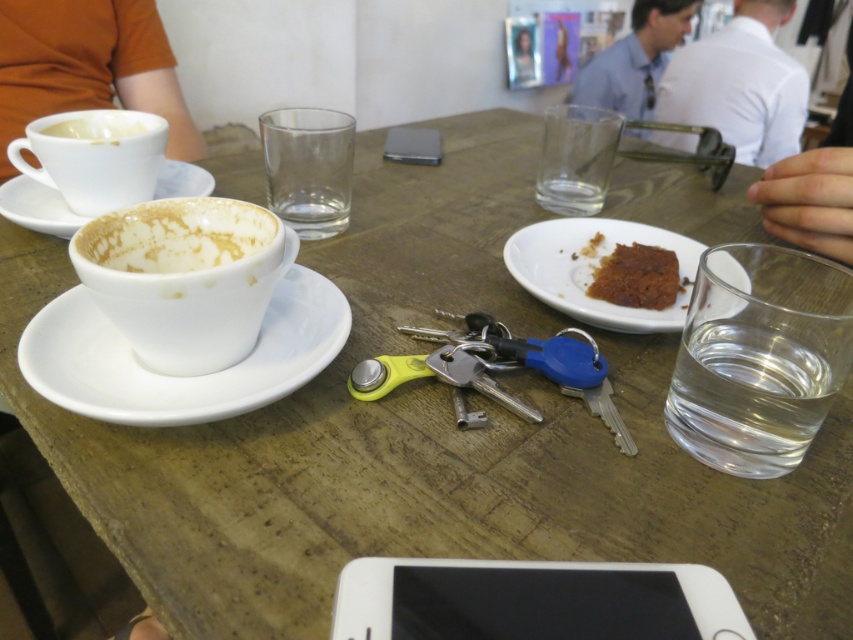
Question: Is matte orange shirt at upper left in front of white shirt at upper right?

Choices:
 (A) yes
 (B) no

Answer: (A)

Question: Estimate the real-world distances between objects in this image. Which object is farther from the white ceramic cup at upper left?

Choices:
 (A) white matte cup at upper left
 (B) white ceramic saucer at left

Answer: (B)

Question: Can you confirm if white ceramic saucer at lower left is positioned below blue shirt at upper center?

Choices:
 (A) yes
 (B) no

Answer: (A)

Question: Which object is farther from the camera taking this photo?

Choices:
 (A) smooth plastic photo frame at upper center
 (B) matte orange shirt at upper left
 (C) white ceramic cup at upper left
 (D) transparent glass at upper center

Answer: (A)

Question: Which object is the farthest from the white ceramic plate at center-right?

Choices:
 (A) white matte cup at upper left
 (B) white ceramic saucer at left

Answer: (A)

Question: Can you confirm if white ceramic saucer at lower left is thinner than smooth plastic photo frame at upper center?

Choices:
 (A) yes
 (B) no

Answer: (B)